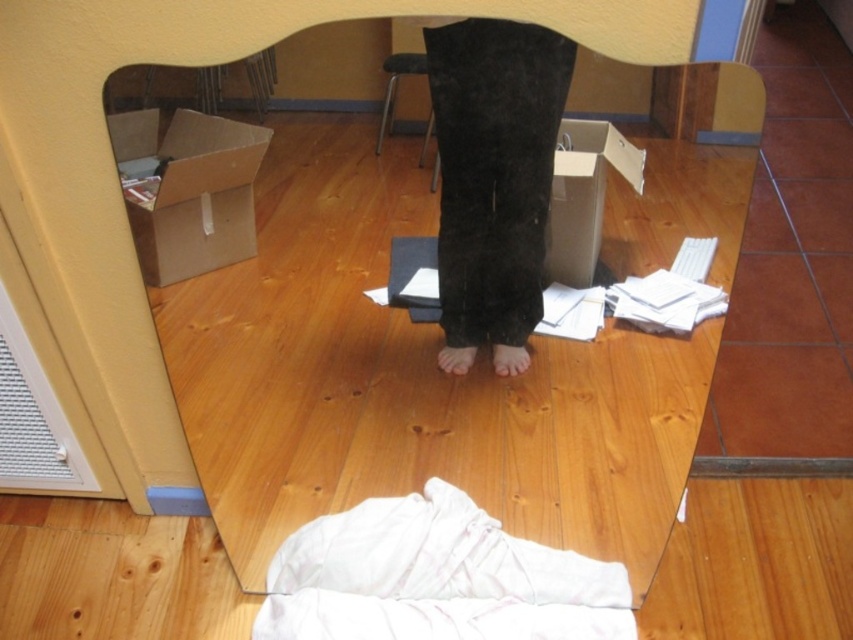
Is metallic silver stool at center to the left of pink matte skin at center from the viewer's perspective?

Indeed, metallic silver stool at center is positioned on the left side of pink matte skin at center.

Which is more to the right, metallic silver stool at center or pink matte skin at center?

pink matte skin at center is more to the right.

Locate an element on the screen. metallic silver stool at center is located at coordinates (396, 84).

Can you confirm if metallic silver stool at center is thinner than barefoot at center?

In fact, metallic silver stool at center might be wider than barefoot at center.

At what (x,y) coordinates should I click in order to perform the action: click on metallic silver stool at center. Please return your answer as a coordinate pair (x, y). The image size is (853, 640). Looking at the image, I should click on 396,84.

Which is more to the left, pink matte skin at center or barefoot at center?

From the viewer's perspective, barefoot at center appears more on the left side.

Is point (498, 372) behind point (448, 364)?

That is False.

This screenshot has height=640, width=853. I want to click on pink matte skin at center, so click(509, 358).